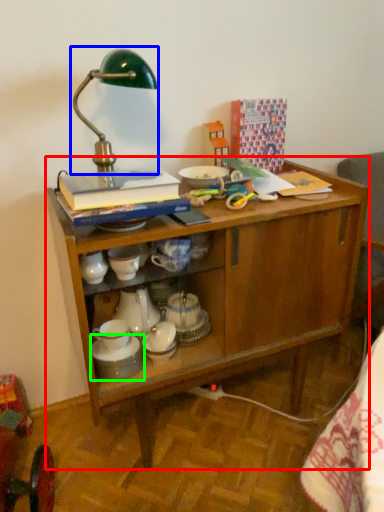
Question: Which is nearer to the desk (highlighted by a red box)? table lamp (highlighted by a blue box) or tableware (highlighted by a green box).

Choices:
 (A) table lamp
 (B) tableware

Answer: (B)